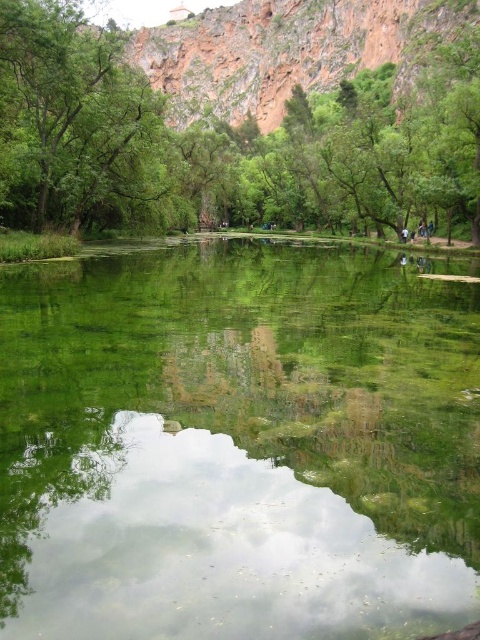
You are standing at the edge of the water in the image. Which of the two trees, the green leafy tree at center or the green leafy tree at upper left, would appear closer to you?

The green leafy tree at upper left appears closer because it is positioned higher up in the image, which typically indicates a closer proximity in such landscapes.

You are a photographer trying to capture the entire scene. The green reflective water at center and the green leafy tree at upper left are both in your viewfinder. Which object will occupy more space in your photo?

The green reflective water at center will occupy more space in your photo because it is bigger than the green leafy tree at upper left according to the description.